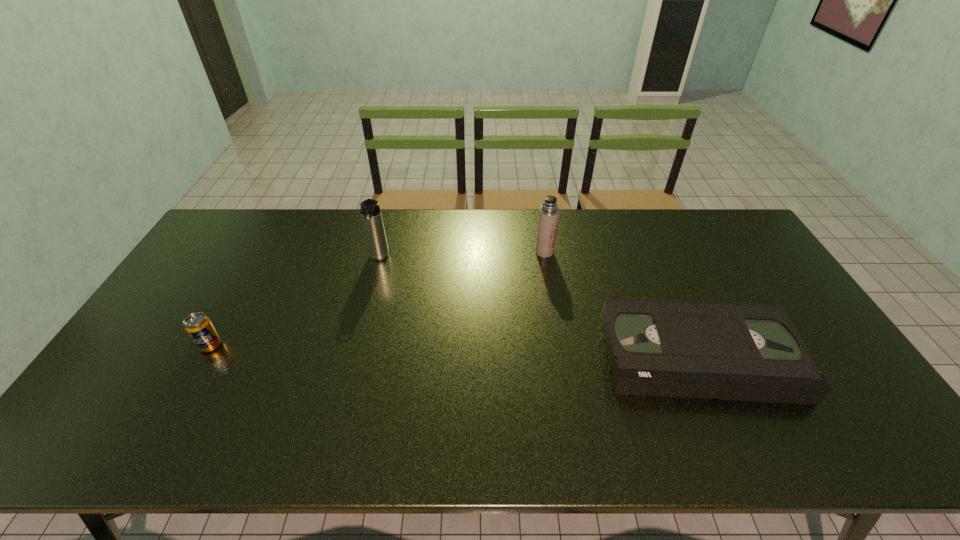
The height and width of the screenshot is (540, 960). I want to click on the third object from right to left, so click(370, 210).

Where is `the third object from left to right`? The width and height of the screenshot is (960, 540). the third object from left to right is located at coordinates pos(548,217).

This screenshot has width=960, height=540. Identify the location of soda can. (198, 326).

The height and width of the screenshot is (540, 960). I want to click on the second shortest object, so click(x=198, y=326).

At what (x,y) coordinates should I click in order to perform the action: click on the shortest object. Please return your answer as a coordinate pair (x, y). Looking at the image, I should click on (688, 349).

Image resolution: width=960 pixels, height=540 pixels. Identify the location of videotape. (688, 349).

Where is `free space located 0.320m on the handle side of the second object from left to right`? free space located 0.320m on the handle side of the second object from left to right is located at coordinates (356, 346).

Locate an element on the screen. This screenshot has width=960, height=540. free space located 0.400m on the left of the right thermos bottle is located at coordinates click(418, 252).

You are a GUI agent. You are given a task and a screenshot of the screen. Output one action in this format:
    pyautogui.click(x=<x>, y=<y>)
    Task: Click on the free space located on the back of the leftmost object
    
    Given the screenshot: What is the action you would take?
    pyautogui.click(x=228, y=312)

Where is `free region located on the left of the rightmost object`? This screenshot has width=960, height=540. free region located on the left of the rightmost object is located at coordinates (560, 355).